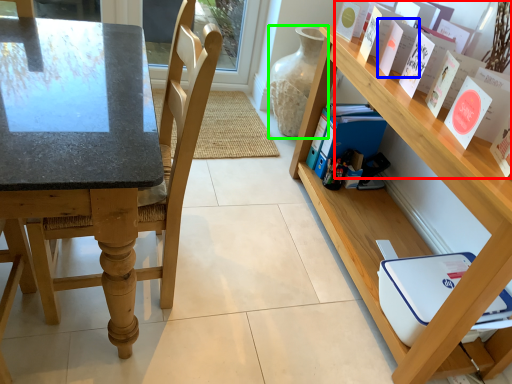
Question: Which object is the farthest from book (highlighted by a red box)? Choose among these: paperback book (highlighted by a blue box) or glass vase (highlighted by a green box).

Choices:
 (A) paperback book
 (B) glass vase

Answer: (B)